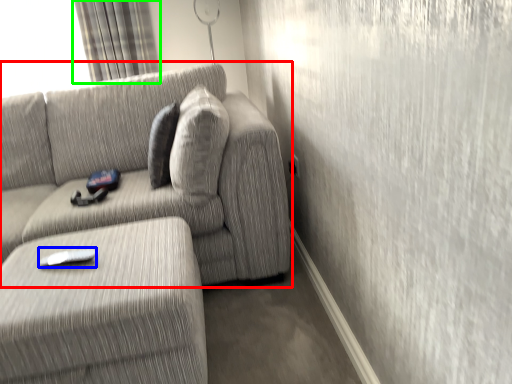
Question: Which object is positioned closest to studio couch (highlighted by a red box)? Select from remote (highlighted by a blue box) and curtain (highlighted by a green box).

Choices:
 (A) remote
 (B) curtain

Answer: (A)